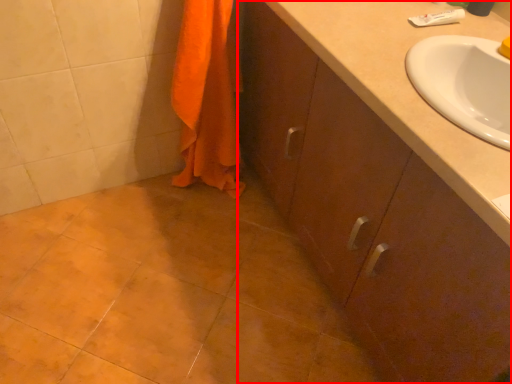
Question: Observing the image, what is the correct spatial positioning of bathroom cabinet (annotated by the red box) in reference to bath towel?

Choices:
 (A) left
 (B) right

Answer: (B)